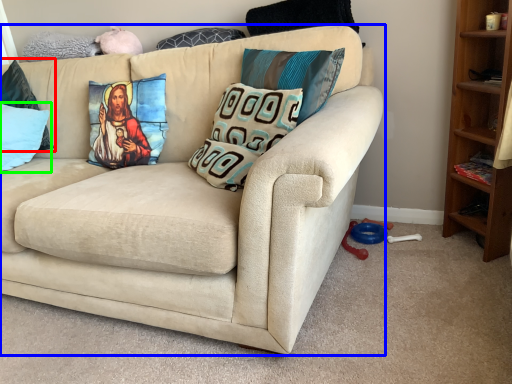
Question: Estimate the real-world distances between objects in this image. Which object is closer to pillow (highlighted by a red box), studio couch (highlighted by a blue box) or pillow (highlighted by a green box)?

Choices:
 (A) studio couch
 (B) pillow

Answer: (B)